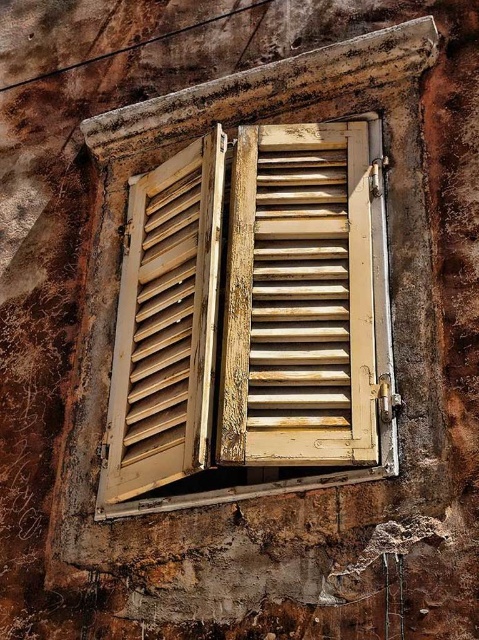
Identify the location of wooden shutters at center. (252, 317).

Is point (339, 305) farther from camera compared to point (149, 378)?

No, (339, 305) is in front of (149, 378).

Where is `wooden shutters at center`? The width and height of the screenshot is (479, 640). wooden shutters at center is located at coordinates (252, 317).